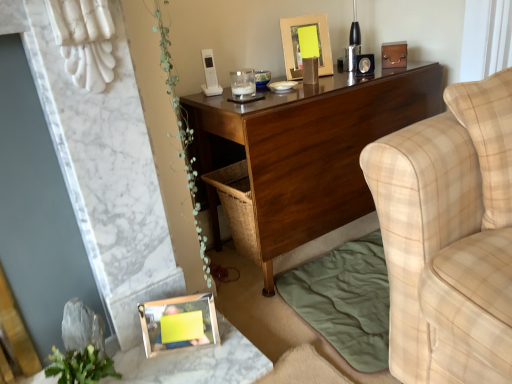
Describe the element at coordinates (313, 148) in the screenshot. Image resolution: width=512 pixels, height=384 pixels. I see `dark wood desk at center` at that location.

From the picture: Measure the distance between wooden photo frame at lower left, placed as the second picture frame when sorted from right to left, and camera.

The distance of wooden photo frame at lower left, placed as the second picture frame when sorted from right to left, from camera is 1.29 meters.

What do you see at coordinates (306, 44) in the screenshot? The width and height of the screenshot is (512, 384). I see `gold metallic picture frame at upper center, acting as the second picture frame starting from the front` at bounding box center [306, 44].

What do you see at coordinates (449, 236) in the screenshot? I see `beige plaid fabric couch at right` at bounding box center [449, 236].

Measure the distance between point (436, 312) and camera.

Point (436, 312) is 35.47 inches from camera.

This screenshot has width=512, height=384. What are the coordinates of `dark wood desk at center` in the screenshot? It's located at (313, 148).

Does wooden photo frame at lower left, acting as the 1th picture frame starting from the left, have a larger size compared to dark wood desk at center?

No.

Considering the relative positions of wooden photo frame at lower left, the 2th picture frame when ordered from top to bottom, and dark wood desk at center in the image provided, is wooden photo frame at lower left, the 2th picture frame when ordered from top to bottom, to the right of dark wood desk at center from the viewer's perspective?

No.

Is wooden photo frame at lower left, placed as the 1th picture frame when sorted from bottom to top, beside dark wood desk at center?

No.

From the image's perspective, is wooden photo frame at lower left, placed as the 1th picture frame when sorted from bottom to top, over dark wood desk at center?

No, from the image's perspective, wooden photo frame at lower left, placed as the 1th picture frame when sorted from bottom to top, is not over dark wood desk at center.

Would you say wooden frame at lower left is outside beige plaid fabric couch at right?

wooden frame at lower left is positioned outside beige plaid fabric couch at right.

Does wooden frame at lower left have a smaller size compared to beige plaid fabric couch at right?

Yes, wooden frame at lower left is smaller than beige plaid fabric couch at right.

The height and width of the screenshot is (384, 512). Find the location of `table below the beige plaid fabric couch at right (from a real-world perspective)`. table below the beige plaid fabric couch at right (from a real-world perspective) is located at coordinates (196, 362).

Is wooden frame at lower left wider than beige plaid fabric couch at right?

No.

Are wooden photo frame at lower left, the second picture frame in the back-to-front sequence, and beige plaid fabric couch at right making contact?

They are not placed beside each other.

Which is closer, [146,330] or [507,189]?

The point [507,189] is in front.

Considering the positions of objects wooden photo frame at lower left, the 2th picture frame when ordered from top to bottom, and beige plaid fabric couch at right in the image provided, who is more to the right, wooden photo frame at lower left, the 2th picture frame when ordered from top to bottom, or beige plaid fabric couch at right?

beige plaid fabric couch at right is more to the right.

Relative to beige plaid fabric couch at right, is wooden photo frame at lower left, the second picture frame in the back-to-front sequence, in front or behind?

In the image, wooden photo frame at lower left, the second picture frame in the back-to-front sequence, appears behind beige plaid fabric couch at right.

This screenshot has height=384, width=512. In order to click on studio couch that appears on the right of wooden photo frame at lower left, the 2th picture frame when ordered from top to bottom in this screenshot , I will do `click(449, 236)`.

From a real-world perspective, who is located higher, beige plaid fabric couch at right or wooden photo frame at lower left, the 2th picture frame when ordered from top to bottom?

beige plaid fabric couch at right, from a real-world perspective.

From the image's perspective, which is above, beige plaid fabric couch at right or wooden photo frame at lower left, placed as the second picture frame when sorted from right to left?

beige plaid fabric couch at right, from the image's perspective.

In the scene shown: What's the angular difference between beige plaid fabric couch at right and wooden photo frame at lower left, placed as the second picture frame when sorted from right to left,'s facing directions?

64.4 degrees.

From a real-world perspective, which object rests below the other?

beige plaid fabric couch at right.

Is gold metallic picture frame at upper center, the 2th picture frame from the bottom, in front of beige plaid fabric couch at right?

No, gold metallic picture frame at upper center, the 2th picture frame from the bottom, is further to the viewer.

Who is taller, gold metallic picture frame at upper center, acting as the second picture frame starting from the front, or beige plaid fabric couch at right?

beige plaid fabric couch at right.

From the image's perspective, is gold metallic picture frame at upper center, marked as the first picture frame in a right-to-left arrangement, above beige plaid fabric couch at right?

Correct, gold metallic picture frame at upper center, marked as the first picture frame in a right-to-left arrangement, appears higher than beige plaid fabric couch at right in the image.

From a real-world perspective, who is located higher, gold metallic picture frame at upper center, placed as the second picture frame when sorted from left to right, or wooden photo frame at lower left, placed as the second picture frame when sorted from right to left?

In real-world perspective, gold metallic picture frame at upper center, placed as the second picture frame when sorted from left to right, is above.

Is gold metallic picture frame at upper center, acting as the second picture frame starting from the front, bigger than wooden photo frame at lower left, the second picture frame in the back-to-front sequence?

Correct, gold metallic picture frame at upper center, acting as the second picture frame starting from the front, is larger in size than wooden photo frame at lower left, the second picture frame in the back-to-front sequence.

The height and width of the screenshot is (384, 512). I want to click on picture frame that appears on the right of wooden photo frame at lower left, placed as the 1th picture frame when sorted from bottom to top, so click(x=306, y=44).

Considering the points (286, 28) and (151, 323), which point is behind, point (286, 28) or point (151, 323)?

Positioned behind is point (286, 28).

Which object is thinner, beige plaid fabric couch at right or green leafy plant at lower left?

green leafy plant at lower left is thinner.

Between beige plaid fabric couch at right and green leafy plant at lower left, which one has less height?

green leafy plant at lower left.

Where is `the 2nd picture frame to the left of the dark wood desk at center, counting from the anchor's position`? the 2nd picture frame to the left of the dark wood desk at center, counting from the anchor's position is located at coordinates (179, 323).

Image resolution: width=512 pixels, height=384 pixels. Identify the location of studio couch in front of the wooden frame at lower left. (449, 236).

From the image, which object appears to be farther from gold metallic picture frame at upper center, marked as the first picture frame in a right-to-left arrangement, green leafy plant at lower left or dark wood desk at center?

The object further to gold metallic picture frame at upper center, marked as the first picture frame in a right-to-left arrangement, is green leafy plant at lower left.

Based on their spatial positions, is gold metallic picture frame at upper center, which is counted as the first picture frame, starting from the back, or wooden photo frame at lower left, the 2th picture frame when ordered from top to bottom, further from green leafy plant at lower left?

Among the two, gold metallic picture frame at upper center, which is counted as the first picture frame, starting from the back, is located further to green leafy plant at lower left.

Estimate the real-world distances between objects in this image. Which object is further from gold metallic picture frame at upper center, the 2th picture frame from the bottom, wooden photo frame at lower left, which is counted as the first picture frame, starting from the front, or dark wood desk at center?

wooden photo frame at lower left, which is counted as the first picture frame, starting from the front, is further to gold metallic picture frame at upper center, the 2th picture frame from the bottom.

Estimate the real-world distances between objects in this image. Which object is further from dark wood desk at center, green leafy plant at lower left or gold metallic picture frame at upper center, marked as the first picture frame in a right-to-left arrangement?

Among the two, green leafy plant at lower left is located further to dark wood desk at center.

Looking at the image, which one is located closer to dark wood desk at center, wooden photo frame at lower left, which is counted as the first picture frame, starting from the front, or green leafy plant at lower left?

wooden photo frame at lower left, which is counted as the first picture frame, starting from the front, is closer to dark wood desk at center.

Consider the image. From the image, which object appears to be nearer to green leafy plant at lower left, wooden frame at lower left or gold metallic picture frame at upper center, placed as the second picture frame when sorted from left to right?

Based on the image, wooden frame at lower left appears to be nearer to green leafy plant at lower left.

Looking at the image, which one is located further to wooden photo frame at lower left, the 2th picture frame when ordered from top to bottom, green leafy plant at lower left or wooden frame at lower left?

Based on the image, green leafy plant at lower left appears to be further to wooden photo frame at lower left, the 2th picture frame when ordered from top to bottom.

Based on their spatial positions, is green leafy plant at lower left or dark wood desk at center closer to wooden frame at lower left?

green leafy plant at lower left is positioned closer to the anchor wooden frame at lower left.

I want to click on plant located between wooden frame at lower left and wooden photo frame at lower left, the second picture frame in the back-to-front sequence, in the depth direction, so 81,347.

I want to click on desk between green leafy plant at lower left and beige plaid fabric couch at right from left to right, so click(313, 148).

The image size is (512, 384). What are the coordinates of `desk between gold metallic picture frame at upper center, marked as the first picture frame in a right-to-left arrangement, and wooden frame at lower left in the up-down direction` in the screenshot? It's located at (313, 148).

This screenshot has width=512, height=384. In order to click on picture frame between gold metallic picture frame at upper center, marked as the first picture frame in a right-to-left arrangement, and green leafy plant at lower left in the up-down direction in this screenshot , I will do `click(179, 323)`.